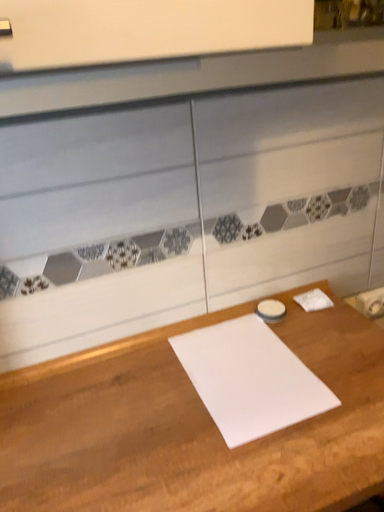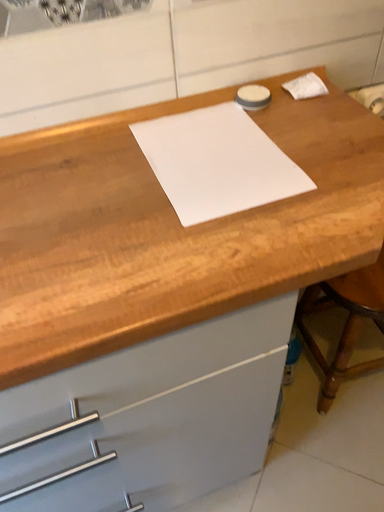
Question: Which way did the camera rotate in the video?

Choices:
 (A) rotated upward
 (B) rotated downward

Answer: (B)